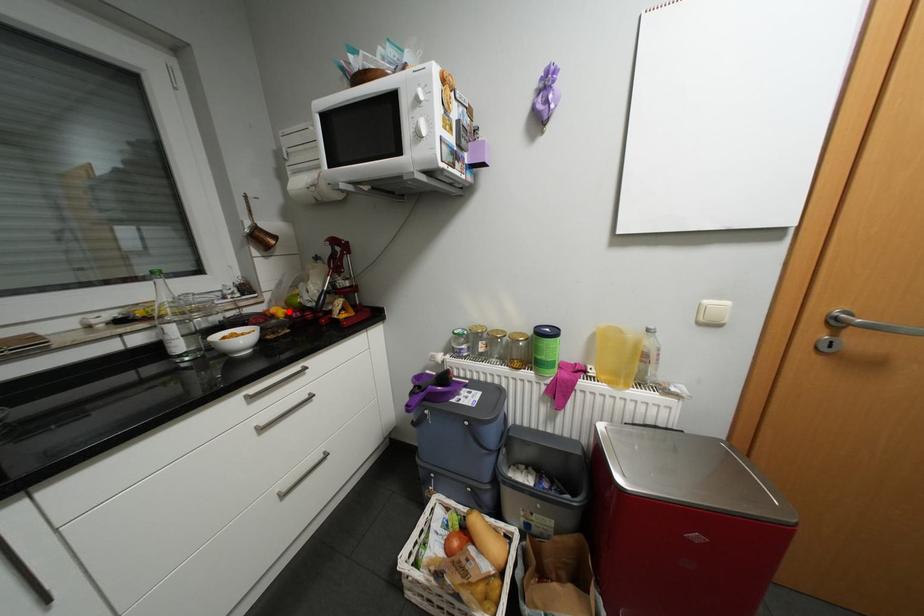
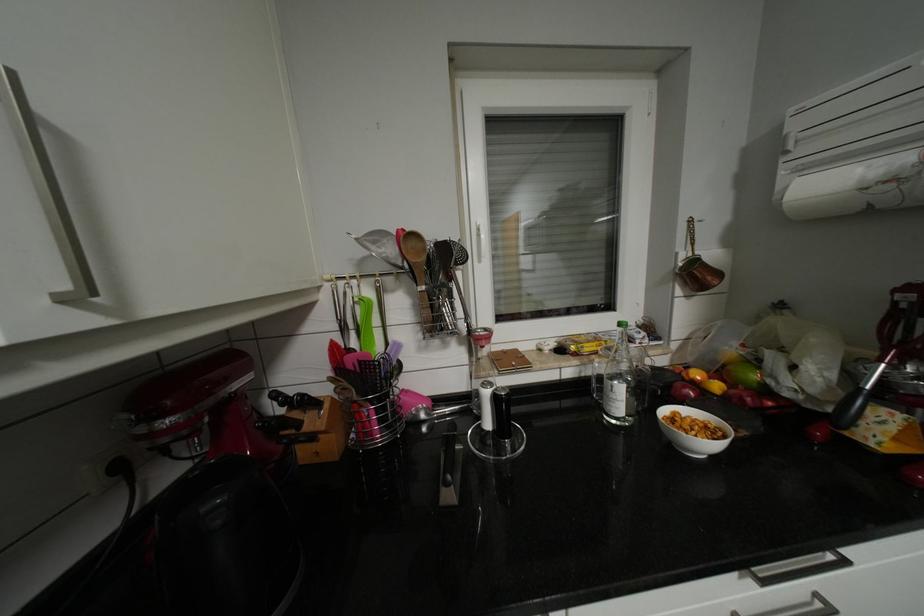
The point at the highlighted location is marked in the first image. Where is the corresponding point in the second image?

(724, 386)